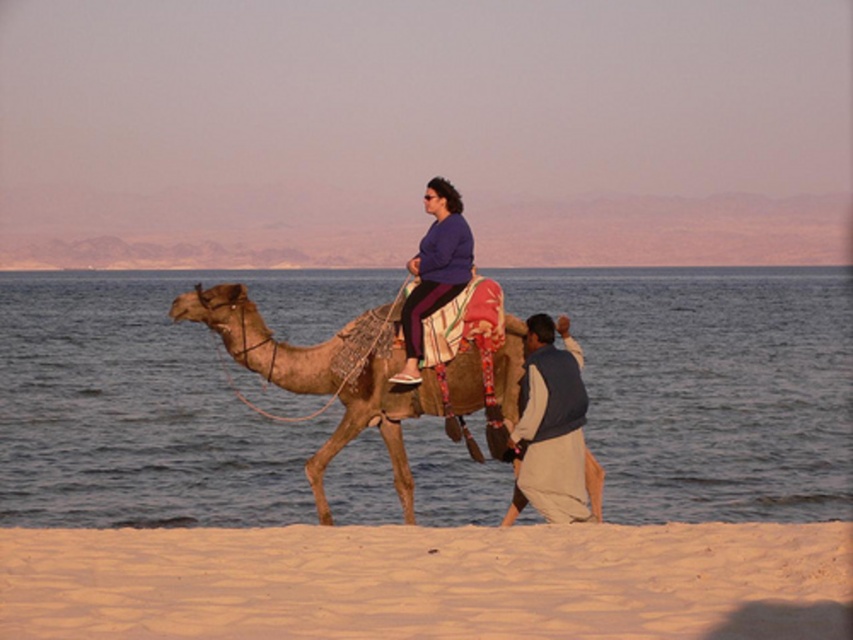
Question: Is sandy beige at lower center thinner than brown textured camel at center?

Choices:
 (A) no
 (B) yes

Answer: (A)

Question: Which point is closer to the camera?

Choices:
 (A) purple fabric at center
 (B) beige cotton pants at lower right
 (C) brown textured camel at center

Answer: (C)

Question: Is the position of sandy beige at lower center less distant than that of purple fabric at center?

Choices:
 (A) no
 (B) yes

Answer: (B)

Question: Considering the real-world distances, which object is farthest from the beige cotton pants at lower right?

Choices:
 (A) smooth sand at lower center
 (B) sandy beige at lower center

Answer: (A)

Question: Is brown textured camel at center further to the viewer compared to beige cotton pants at lower right?

Choices:
 (A) no
 (B) yes

Answer: (A)

Question: Which point is farther to the camera?

Choices:
 (A) (555, 452)
 (B) (585, 620)

Answer: (A)